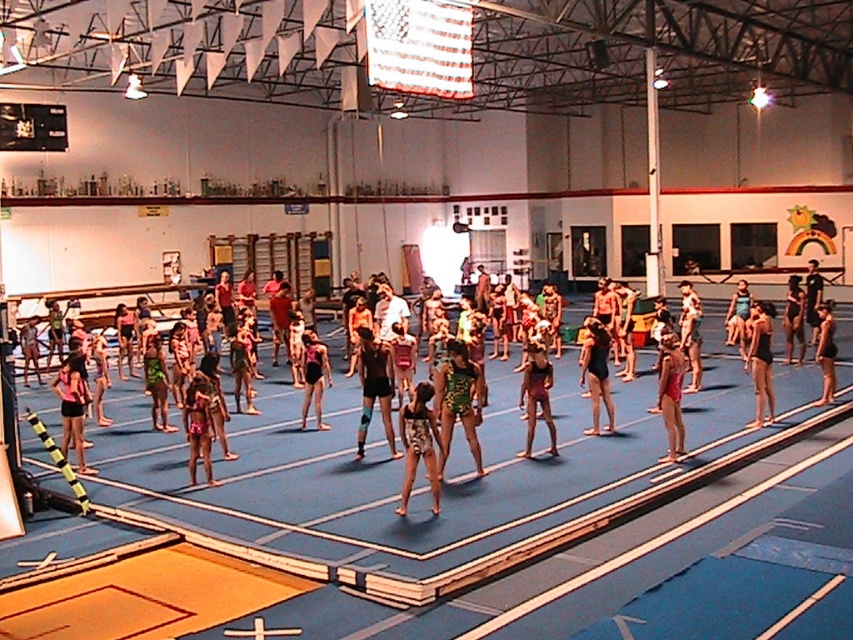
You are standing in the indoor gymnastics facility and want to reach the point marked at coordinates point (425, 420). If your walking speed is 3 feet per second, how many seconds will it take you to reach that point?

The distance between you and point (425, 420) is 31.22 feet. At a speed of 3 feet per second, it will take approximately 10.41 seconds to reach the point.

You are a photographer setting up for a swimwear photoshoot. You have two swimsuits in front of you on a blue mat in the gymnasium. The printed fabric swimsuit at center and the black matte swimsuit at center. Which swimsuit is narrower?

The printed fabric swimsuit at center is narrower than the black matte swimsuit at center.